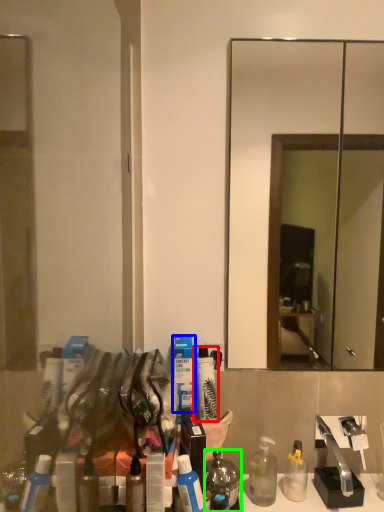
Question: Which object is positioned closest to toiletry (highlighted by a red box)? Select from toiletry (highlighted by a blue box) and mouthwash (highlighted by a green box).

Choices:
 (A) toiletry
 (B) mouthwash

Answer: (A)